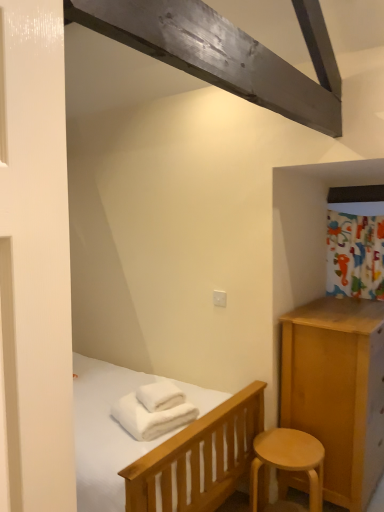
Find the location of a particular element. The image size is (384, 512). empty space that is ontop of white soft bath towel at lower center, acting as the first bath towel starting from the bottom (from a real-world perspective) is located at coordinates (143, 406).